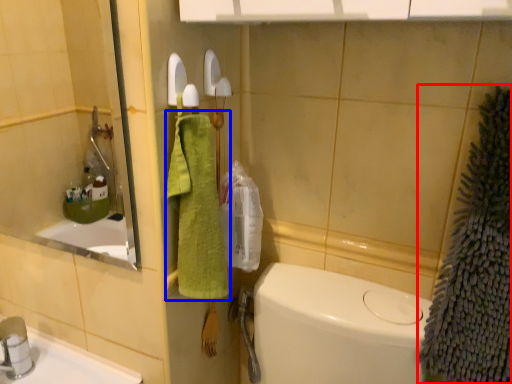
Question: Which point is further to the camera, bath towel (highlighted by a red box) or bath towel (highlighted by a blue box)?

Choices:
 (A) bath towel
 (B) bath towel

Answer: (B)